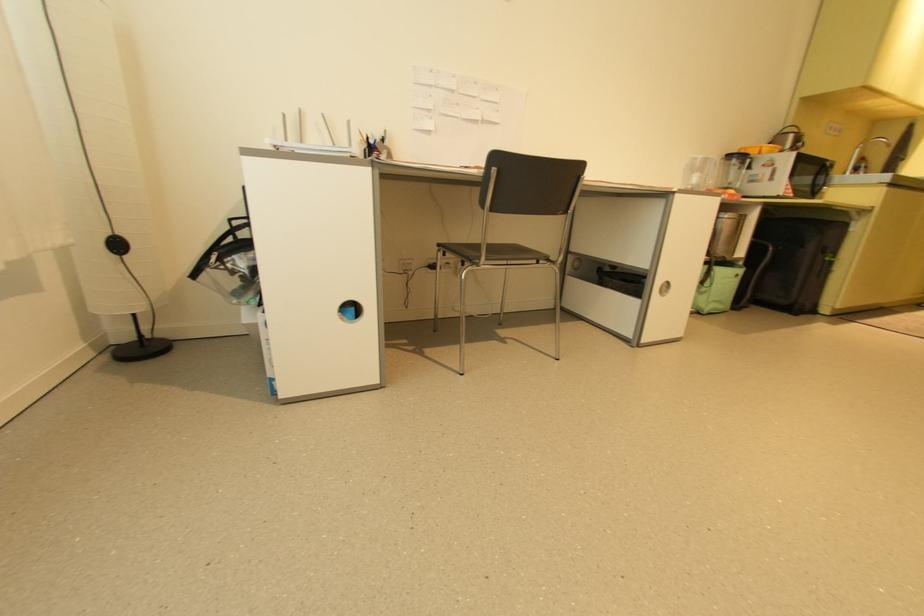
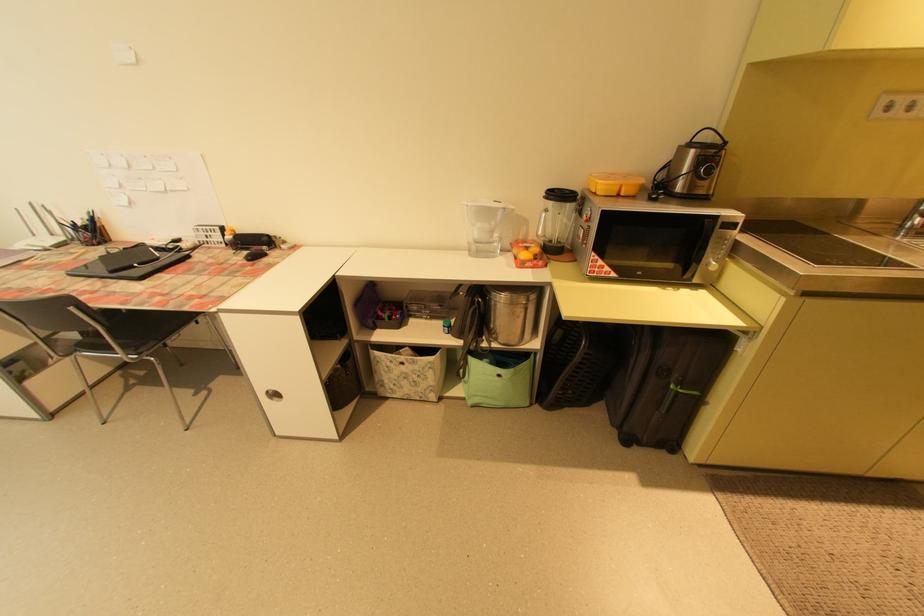
Locate, in the second image, the point that corresponds to [723,302] in the first image.

(492, 398)